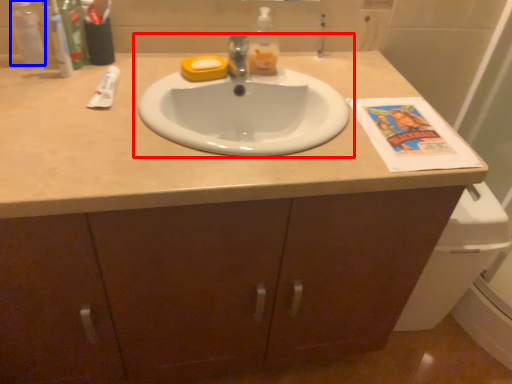
Question: Which point is further to the camera, sink (highlighted by a red box) or bottle (highlighted by a blue box)?

Choices:
 (A) sink
 (B) bottle

Answer: (B)